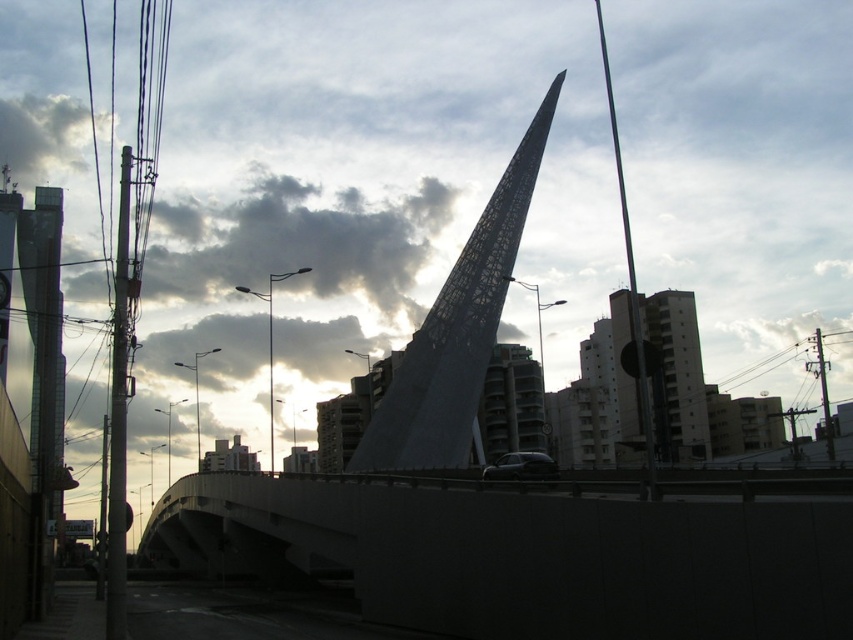
You are standing in the urban scene looking at the central sculpture. There are two points marked on a map of the area. The first point is at coordinates point (519,493) and the second at point (453,304). Which point is closer to your current position if you are facing the sculpture?

Point (519,493) is in front of point (453,304), so if you are facing the sculpture, point (519,493) would be closer to your current position.

Based on the photo, you are a delivery drone with a wingspan of 100 feet. You need to fly between the concrete bridge at center and the shiny black car at center. Can you fit through the space between them?

The distance between the concrete bridge at center and the shiny black car at center is 99.85 feet, so the drone cannot fit through the space between them since its wingspan is slightly wider than the available space.

You are standing at the base of the architectural structure and want to take a photo that includes both the concrete bridge at center and the shiny black car at center. Which object should you position closer to the front of your camera frame to ensure both are in the shot?

The concrete bridge at center is closer to the viewer than the shiny black car at center, so you should position the concrete bridge at center closer to the front of your camera frame to ensure both are in the shot.